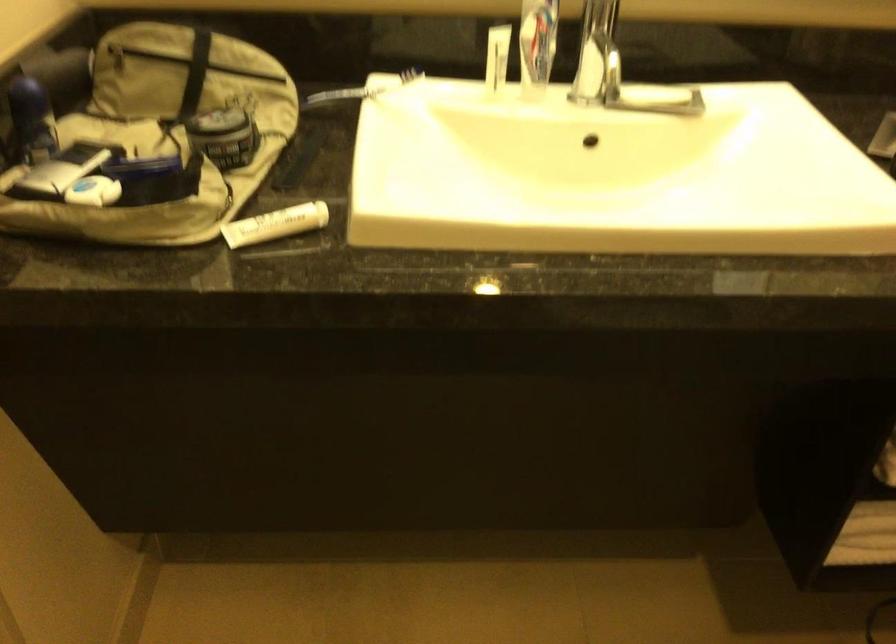
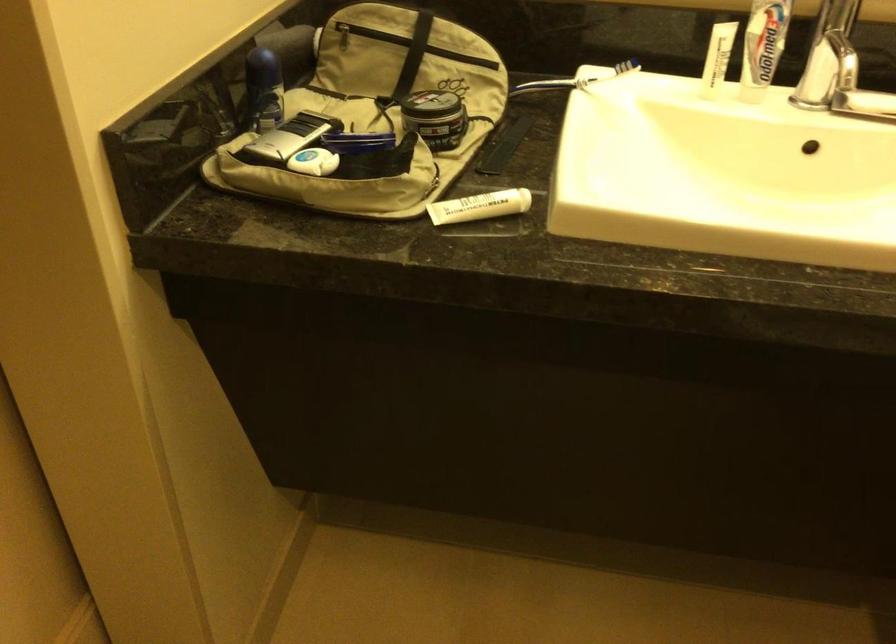
Find the pixel in the second image that matches pixel 273 225 in the first image.

(479, 205)